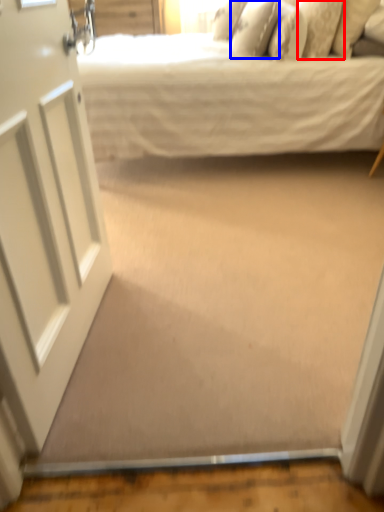
Question: Among these objects, which one is farthest to the camera, pillow (highlighted by a red box) or pillow (highlighted by a blue box)?

Choices:
 (A) pillow
 (B) pillow

Answer: (B)